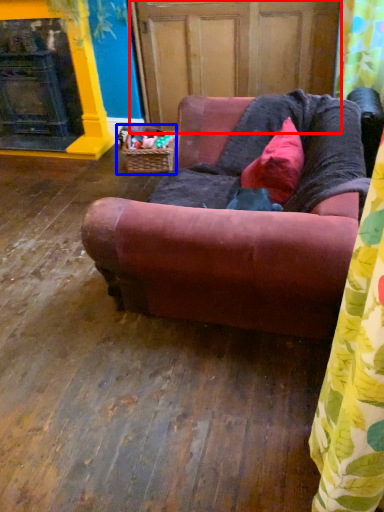
Question: Which point is closer to the camera, screen door (highlighted by a red box) or basket (highlighted by a blue box)?

Choices:
 (A) screen door
 (B) basket

Answer: (A)